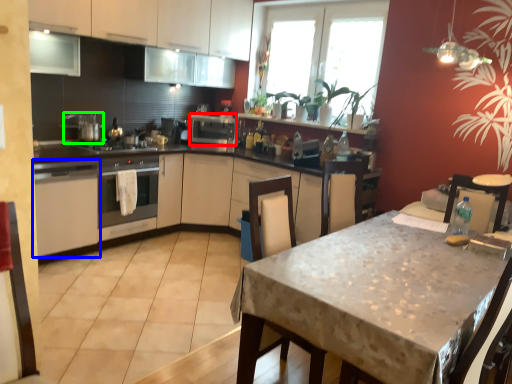
Question: Which object is positioned closest to appliance (highlighted by a red box)? Select from cabinetry (highlighted by a blue box) and appliance (highlighted by a green box).

Choices:
 (A) cabinetry
 (B) appliance

Answer: (B)